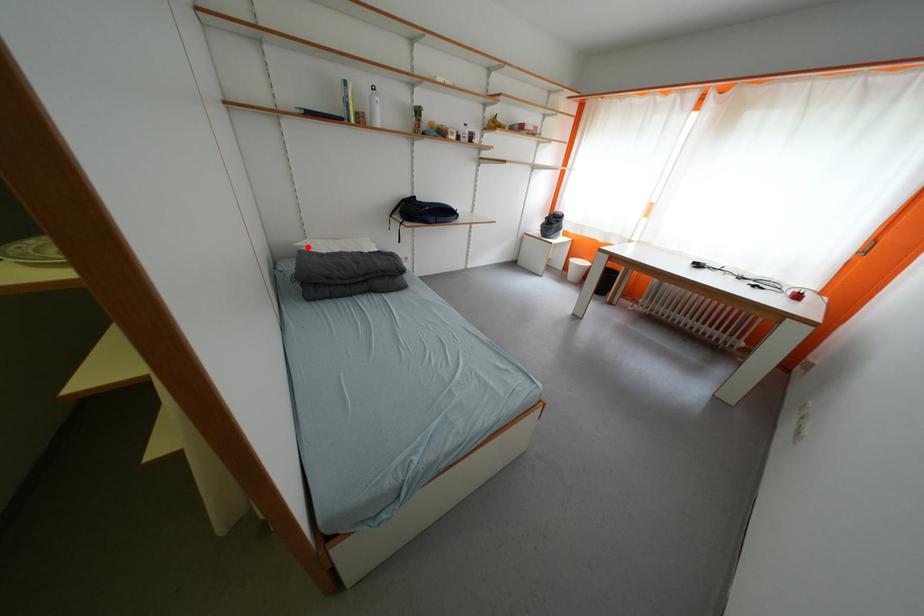
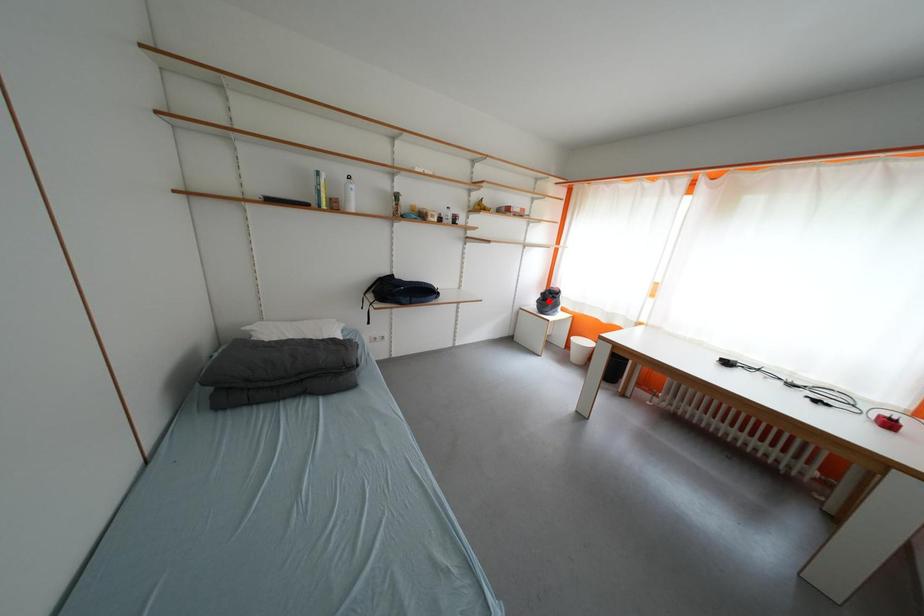
I am providing you with two images of the same scene from different viewpoints. A red point is marked on the first image and another point is marked on the second image. Does the point marked in image1 correspond to the same location as the one in image2?

No